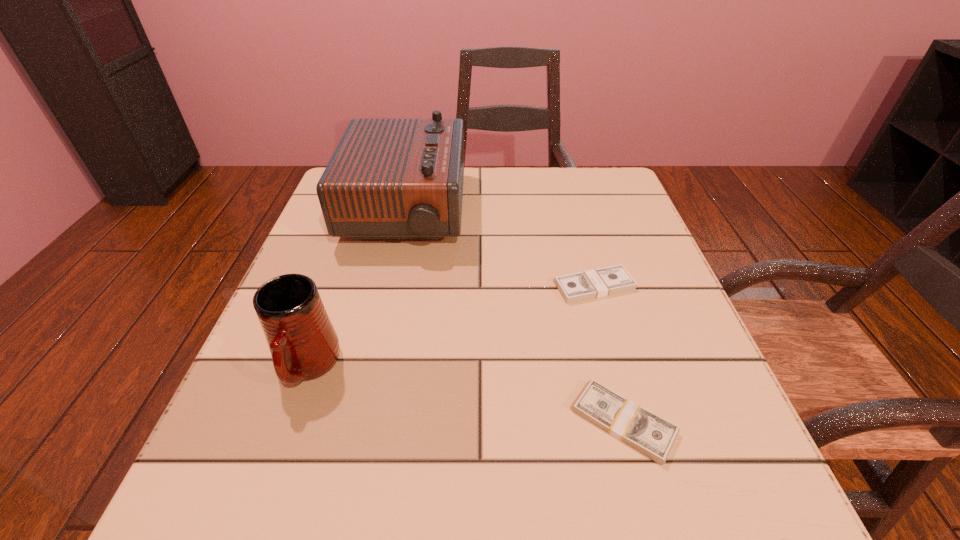
Locate an element on the screen. free point between the tallest object and the third nearest object is located at coordinates (500, 249).

At what (x,y) coordinates should I click in order to perform the action: click on object that ranks as the closest to the nearer dollar. Please return your answer as a coordinate pair (x, y). The image size is (960, 540). Looking at the image, I should click on (606, 281).

Point out which object is positioned as the third nearest to the nearer dollar. Please provide its 2D coordinates. Your answer should be formatted as a tuple, i.e. [(x, y)], where the tuple contains the x and y coordinates of a point satisfying the conditions above.

[(303, 343)]

Find the location of a particular element. This screenshot has width=960, height=540. vacant position in the image that satisfies the following two spatial constraints: 1. on the side of the mug with the handle; 2. on the left side of the nearer dollar is located at coordinates click(288, 422).

Find the location of `blank space that satisfies the following two spatial constraints: 1. on the side of the second tallest object with the handle; 2. on the right side of the nearer dollar`. blank space that satisfies the following two spatial constraints: 1. on the side of the second tallest object with the handle; 2. on the right side of the nearer dollar is located at coordinates (288, 422).

The image size is (960, 540). I want to click on vacant space that satisfies the following two spatial constraints: 1. on the front panel of the nearer dollar; 2. on the left side of the radio receiver, so click(x=358, y=422).

The image size is (960, 540). I want to click on blank space that satisfies the following two spatial constraints: 1. on the front panel of the farthest object; 2. on the side of the mug with the handle, so click(371, 367).

This screenshot has width=960, height=540. Identify the location of free location that satisfies the following two spatial constraints: 1. on the front panel of the nearer dollar; 2. on the right side of the farthest object. (358, 422).

Locate an element on the screen. blank area in the image that satisfies the following two spatial constraints: 1. on the front panel of the radio receiver; 2. on the side of the mug with the handle is located at coordinates (371, 367).

The width and height of the screenshot is (960, 540). What are the coordinates of `vacant space that satisfies the following two spatial constraints: 1. on the back side of the nearer dollar; 2. on the front panel of the tallest object` in the screenshot? It's located at (567, 211).